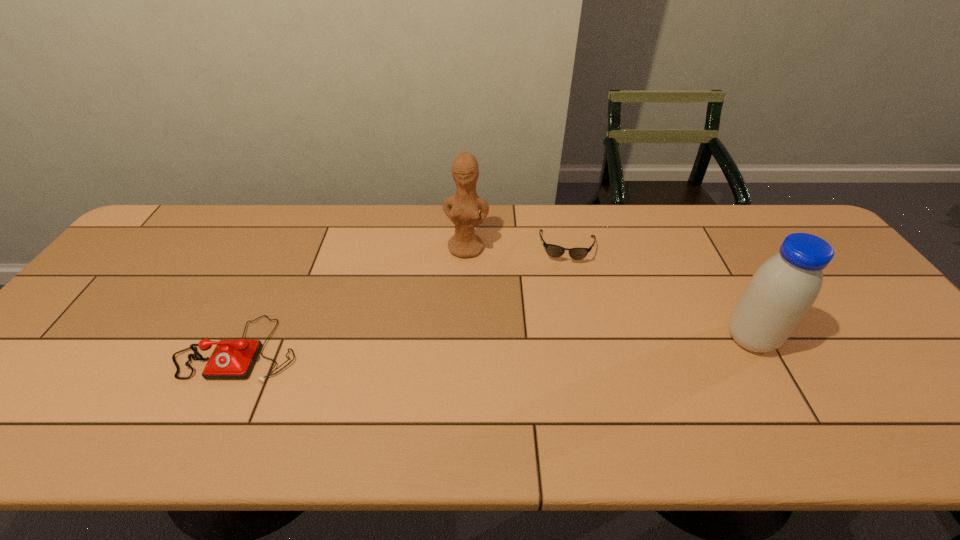
This screenshot has width=960, height=540. Identify the location of free space between the second shortest object and the second object from right to left. (403, 298).

Point out which object is positioned as the nearest to the sunglasses. Please provide its 2D coordinates. Your answer should be formatted as a tuple, i.e. [(x, y)], where the tuple contains the x and y coordinates of a point satisfying the conditions above.

[(462, 209)]

I want to click on object that is the third closest to the figurine, so click(x=783, y=289).

Image resolution: width=960 pixels, height=540 pixels. In order to click on vacant space that satisfies the following two spatial constraints: 1. on the front side of the second object from left to right; 2. on the left side of the rightmost object in this screenshot , I will do `click(464, 339)`.